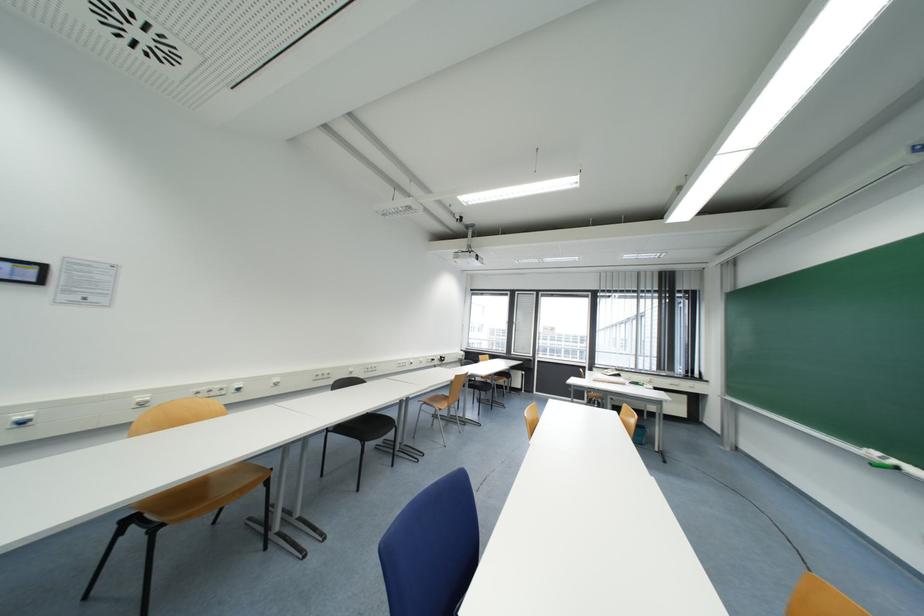
Find where to sit the black chair sitting surface. Please return your answer as a coordinate pair (x, y).

(365, 427)